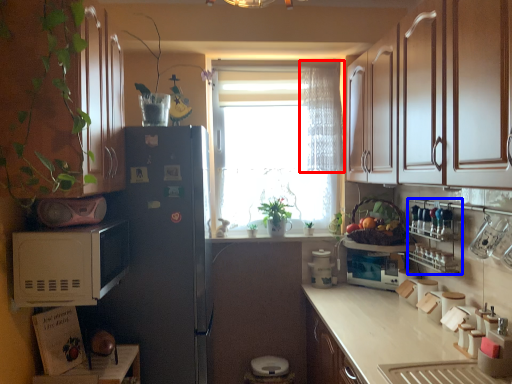
Question: Which point is further to the camera, curtain (highlighted by a red box) or shelf (highlighted by a blue box)?

Choices:
 (A) curtain
 (B) shelf

Answer: (A)